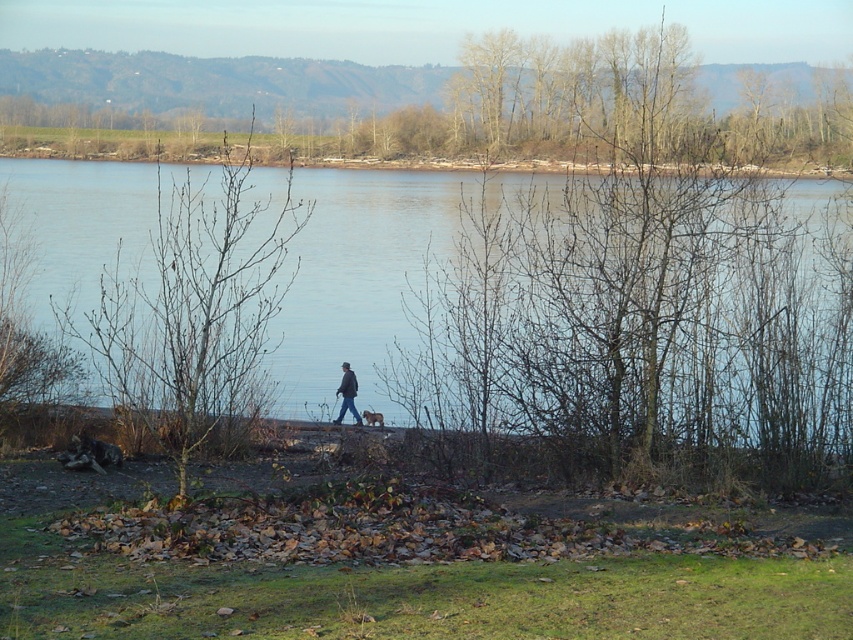
Question: Which point appears farthest from the camera in this image?

Choices:
 (A) (631, 196)
 (B) (367, 417)

Answer: (B)

Question: Is blue water at center above dark gray jacket at center?

Choices:
 (A) no
 (B) yes

Answer: (B)

Question: Does blue water at center appear over dark gray jacket at center?

Choices:
 (A) no
 (B) yes

Answer: (B)

Question: Does bare branches at center have a larger size compared to bare branches at left?

Choices:
 (A) yes
 (B) no

Answer: (A)

Question: Which is farther from the blue water at center?

Choices:
 (A) bare branches at center
 (B) bare branches at left
 (C) dark gray jacket at center

Answer: (C)

Question: Which object is the closest to the blue water at center?

Choices:
 (A) bare branches at left
 (B) bare branches at center

Answer: (A)